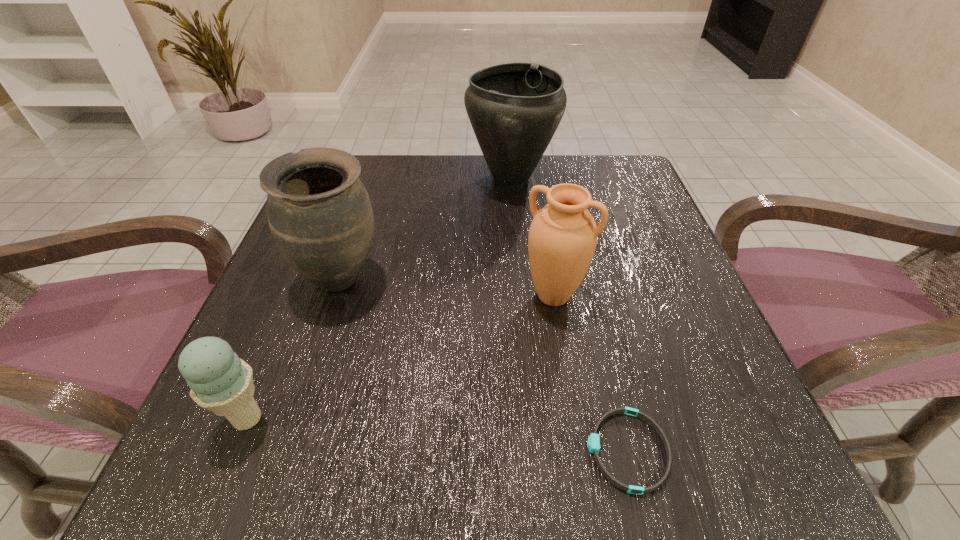
The image size is (960, 540). Find the location of `vacant space at the left edge of the desktop`. vacant space at the left edge of the desktop is located at coordinates (317, 330).

Image resolution: width=960 pixels, height=540 pixels. I want to click on vacant space at the right edge, so click(x=637, y=265).

Find the location of a particular element. vacant position at the far left corner of the desktop is located at coordinates (392, 156).

Where is `vacant space at the near left corner of the desktop`? The image size is (960, 540). vacant space at the near left corner of the desktop is located at coordinates (225, 443).

Locate an element on the screen. Image resolution: width=960 pixels, height=540 pixels. free space at the far right corner of the desktop is located at coordinates (605, 175).

What are the coordinates of `vacant space at the near right corner of the desktop` in the screenshot? It's located at (741, 445).

Image resolution: width=960 pixels, height=540 pixels. Identify the location of blank region between the leftmost urn and the second shortest object. (294, 348).

You are a GUI agent. You are given a task and a screenshot of the screen. Output one action in this format:
    pyautogui.click(x=<x>, y=<y>)
    Task: Click on the empty space that is in between the shortest object and the fourth tallest object
    
    Given the screenshot: What is the action you would take?
    pyautogui.click(x=438, y=435)

You are a GUI agent. You are given a task and a screenshot of the screen. Output one action in this format:
    pyautogui.click(x=<x>, y=<y>)
    Task: Click on the free area in between the ice cream and the leftmost urn
    
    Given the screenshot: What is the action you would take?
    pyautogui.click(x=294, y=348)

This screenshot has height=540, width=960. I want to click on free space that is in between the farthest urn and the fourth tallest object, so click(x=379, y=298).